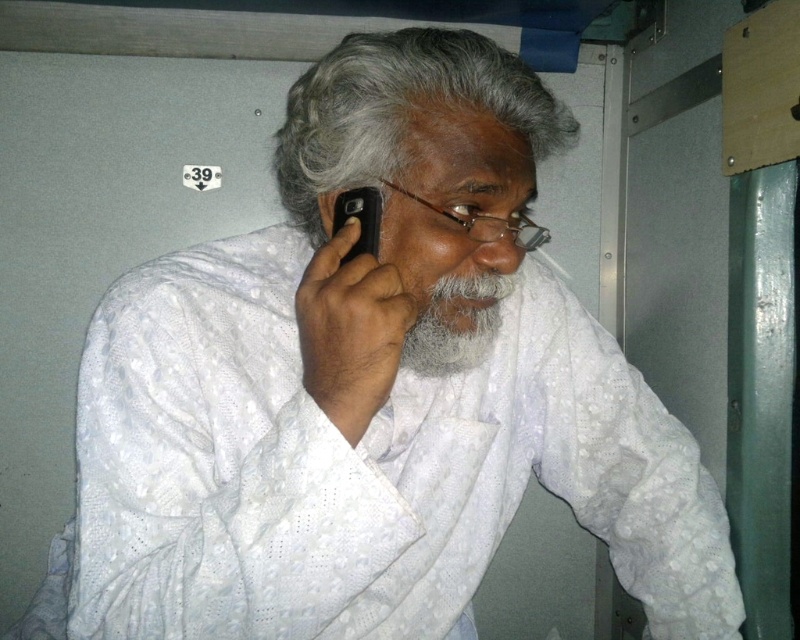
Does gray matte hair at upper center have a greater height compared to black matte smartphone at upper center?

→ Correct, gray matte hair at upper center is much taller as black matte smartphone at upper center.

Does gray matte hair at upper center appear under black matte smartphone at upper center?

No.

Who is more forward, (362, 51) or (366, 248)?

Point (366, 248) is in front.

You are a GUI agent. You are given a task and a screenshot of the screen. Output one action in this format:
    pyautogui.click(x=<x>, y=<y>)
    Task: Click on the gray matte hair at upper center
    The height and width of the screenshot is (640, 800).
    Given the screenshot: What is the action you would take?
    pyautogui.click(x=400, y=109)

This screenshot has width=800, height=640. What do you see at coordinates (400, 109) in the screenshot?
I see `gray matte hair at upper center` at bounding box center [400, 109].

Who is higher up, gray matte hair at upper center or matte black ear at upper right?

Positioned higher is gray matte hair at upper center.

This screenshot has height=640, width=800. What are the coordinates of `gray matte hair at upper center` in the screenshot? It's located at (400, 109).

The width and height of the screenshot is (800, 640). What are the coordinates of `gray matte hair at upper center` in the screenshot? It's located at (400, 109).

You are a GUI agent. You are given a task and a screenshot of the screen. Output one action in this format:
    pyautogui.click(x=<x>, y=<y>)
    Task: Click on the graywoollybeard at center
    This screenshot has height=640, width=800.
    Given the screenshot: What is the action you would take?
    pyautogui.click(x=456, y=324)

Who is more forward, [480,298] or [346,202]?

Point [346,202] is more forward.

You are a GUI agent. You are given a task and a screenshot of the screen. Output one action in this format:
    pyautogui.click(x=<x>, y=<y>)
    Task: Click on the graywoollybeard at center
    
    Given the screenshot: What is the action you would take?
    pyautogui.click(x=456, y=324)